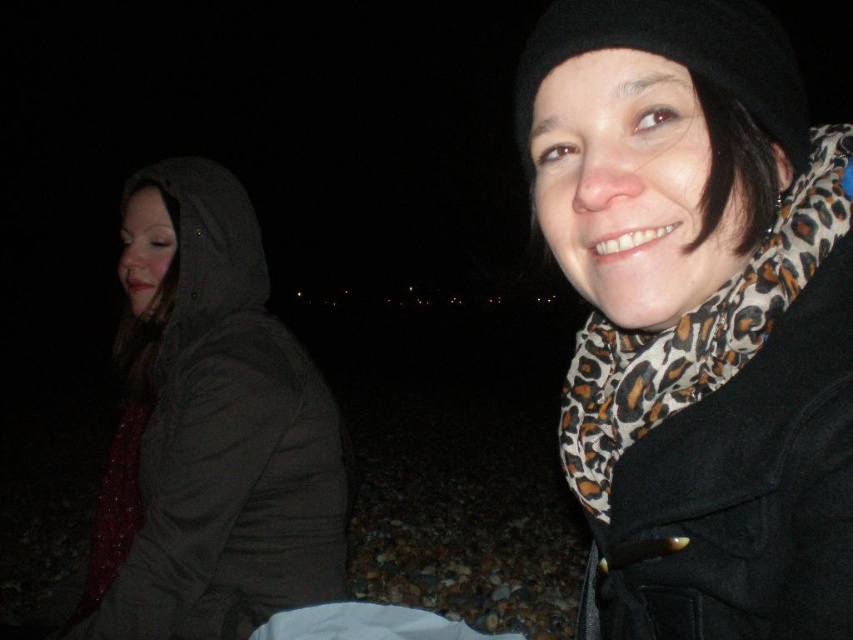
Question: Does dark gray hooded jacket at left come in front of leopard print scarf at upper right?

Choices:
 (A) no
 (B) yes

Answer: (A)

Question: Can you confirm if dark gray hooded jacket at left is bigger than leopard print scarf at upper right?

Choices:
 (A) no
 (B) yes

Answer: (B)

Question: Does dark gray hooded jacket at left have a lesser width compared to leopard print scarf at upper right?

Choices:
 (A) yes
 (B) no

Answer: (B)

Question: Which point is farther to the camera?

Choices:
 (A) leopard print scarf at upper right
 (B) dark gray hooded jacket at left

Answer: (B)